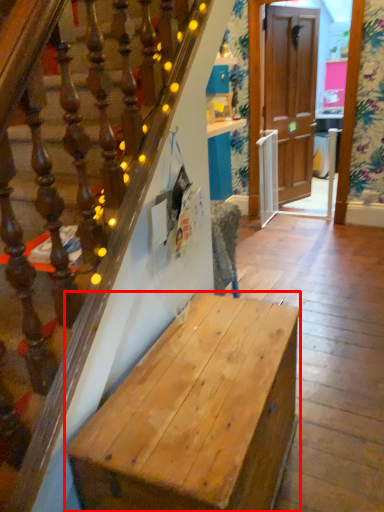
Question: Where is desk (annotated by the red box) located in relation to door in the image?

Choices:
 (A) left
 (B) right

Answer: (A)